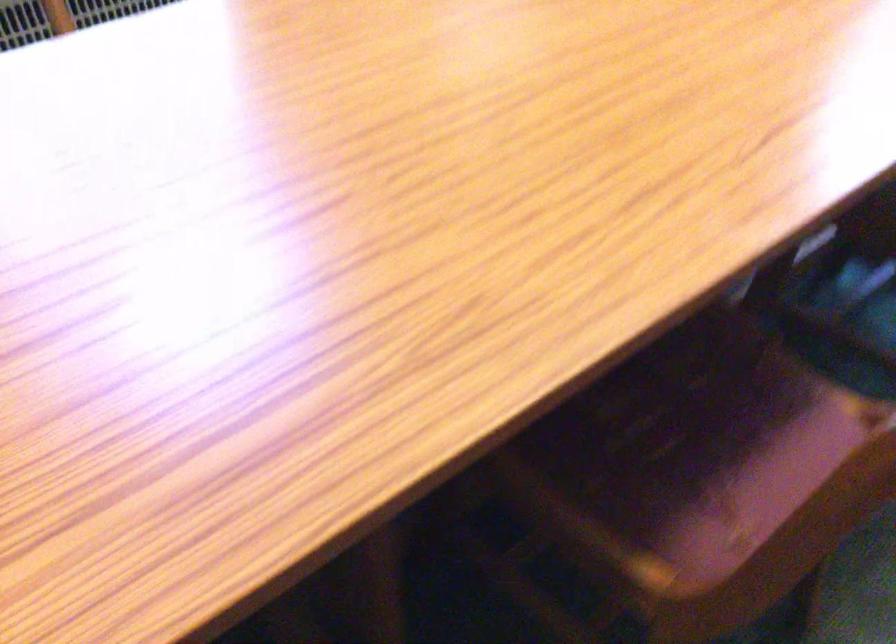
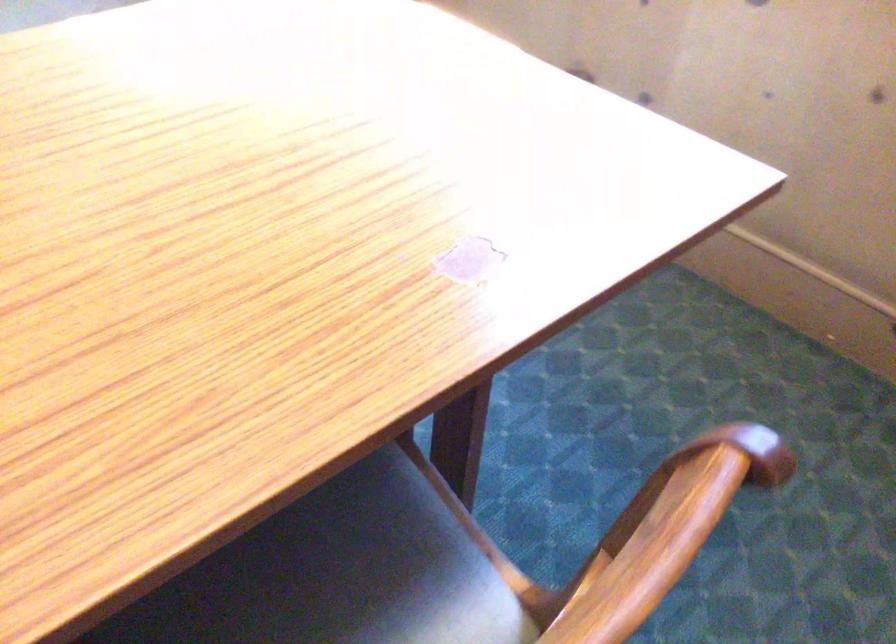
Question: The camera is either moving clockwise (left) or counter-clockwise (right) around the object. The first image is from the beginning of the video and the second image is from the end. Is the camera moving left or right when shooting the video?

Choices:
 (A) Left
 (B) Right

Answer: (A)